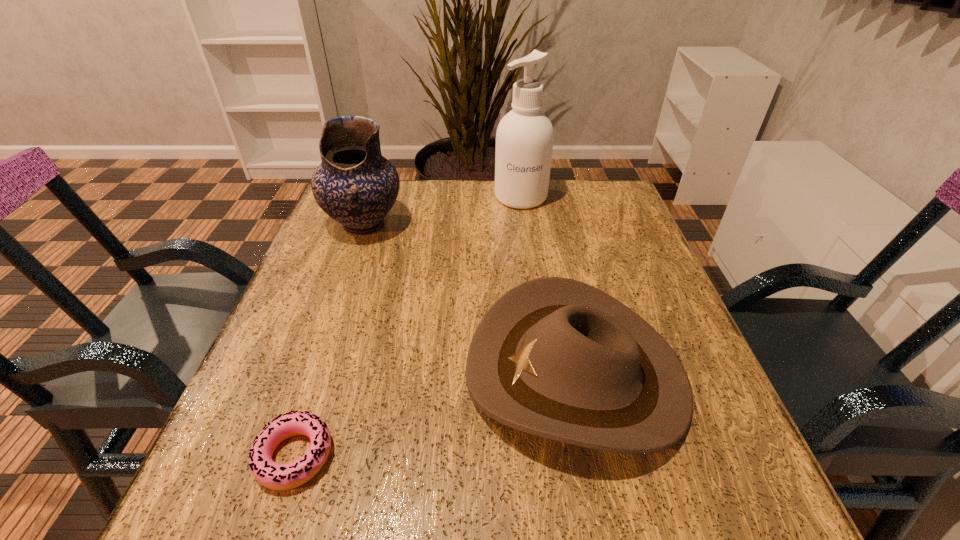
At what (x,y) coordinates should I click in order to perform the action: click on the tallest object. Please return your answer as a coordinate pair (x, y). This screenshot has width=960, height=540. Looking at the image, I should click on click(x=524, y=139).

This screenshot has height=540, width=960. Find the location of `the third shortest object`. the third shortest object is located at coordinates (355, 185).

You are a GUI agent. You are given a task and a screenshot of the screen. Output one action in this format:
    pyautogui.click(x=<x>, y=<y>)
    Task: Click on the cowboy hat
    
    Given the screenshot: What is the action you would take?
    pyautogui.click(x=553, y=357)

At what (x,y) coordinates should I click in order to perform the action: click on the shortest object. Please return your answer as a coordinate pair (x, y). The height and width of the screenshot is (540, 960). Looking at the image, I should click on (270, 474).

Image resolution: width=960 pixels, height=540 pixels. I want to click on vacant space located on the front label of the tallest object, so [536, 311].

The width and height of the screenshot is (960, 540). Find the location of `vacant space situated 0.240m on the right of the pottery`. vacant space situated 0.240m on the right of the pottery is located at coordinates (501, 224).

The width and height of the screenshot is (960, 540). I want to click on vacant space located 0.050m with a star on the front of the cowboy hat, so click(437, 373).

The height and width of the screenshot is (540, 960). I want to click on vacant space situated 0.310m with a star on the front of the cowboy hat, so click(284, 373).

Where is `free space located 0.140m with a star on the front of the cowboy hat`? The height and width of the screenshot is (540, 960). free space located 0.140m with a star on the front of the cowboy hat is located at coordinates (384, 373).

Identify the location of free point located 0.260m on the right of the doughnut. (513, 455).